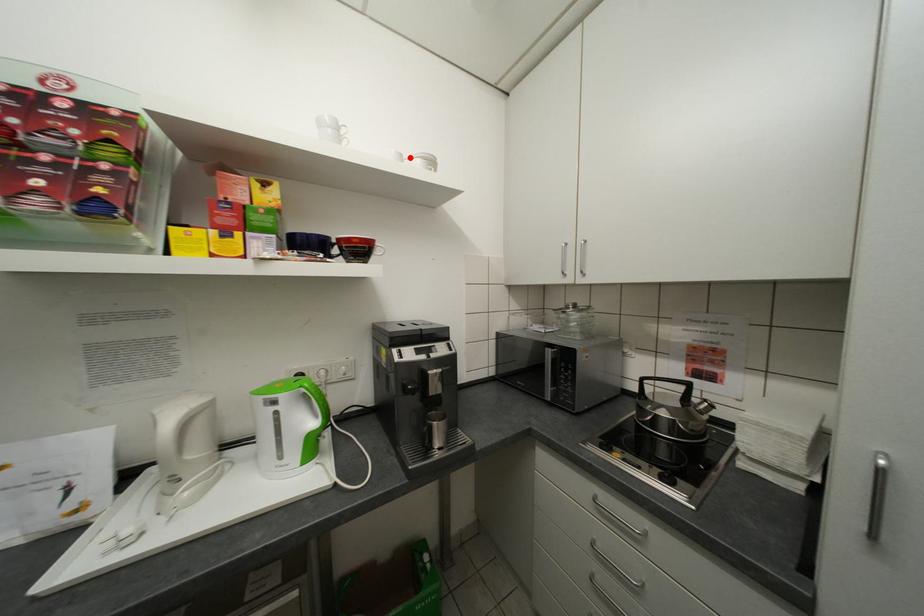
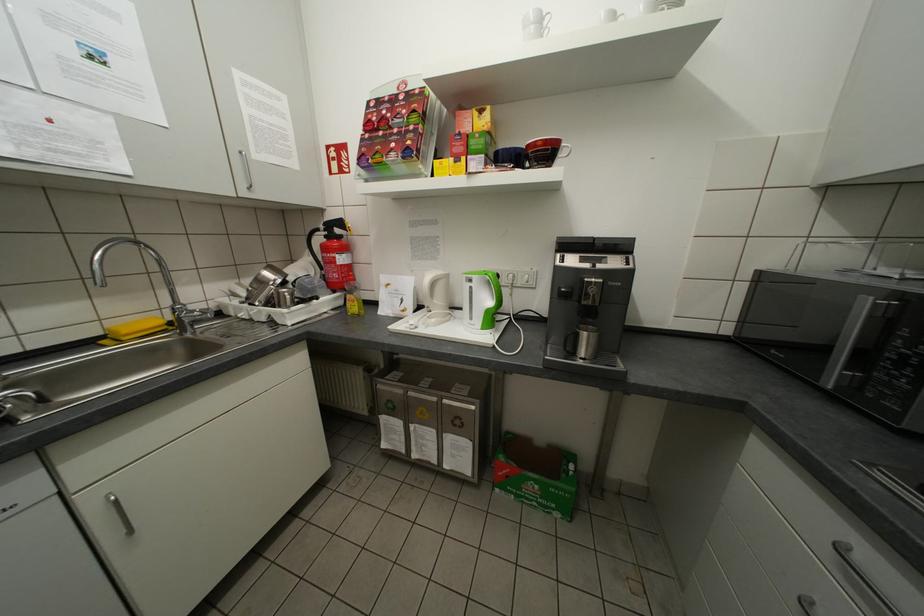
Locate, in the second image, the point that corresponds to the highlighted location in the first image.

(623, 17)